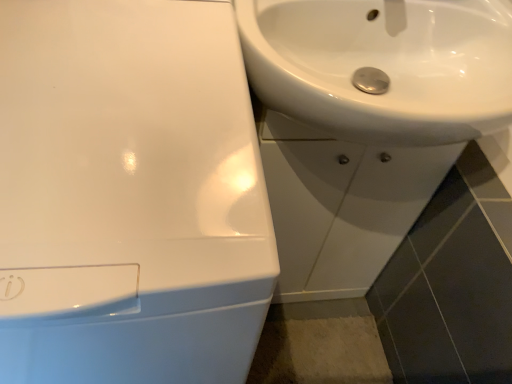
How much space does white glossy sink at center, which ranks as the second sink in left-to-right order, occupy horizontally?

The width of white glossy sink at center, which ranks as the second sink in left-to-right order, is 10.98 inches.

The width and height of the screenshot is (512, 384). What do you see at coordinates (383, 66) in the screenshot?
I see `white glossy sink at upper right, which appears as the third sink when viewed from the left` at bounding box center [383, 66].

Locate an element on the screen. The image size is (512, 384). white glossy sink at center, which ranks as the second sink in left-to-right order is located at coordinates (366, 122).

From the image's perspective, between white glossy sink at upper right, which appears as the third sink when viewed from the left, and white glossy sink at center, which appears as the 2th sink when viewed from the right, who is located below?

white glossy sink at center, which appears as the 2th sink when viewed from the right.

From a real-world perspective, is white glossy sink at upper right, which appears as the first sink when viewed from the right, positioned above or below white glossy sink at center, which appears as the 2th sink when viewed from the right?

white glossy sink at upper right, which appears as the first sink when viewed from the right, is situated higher than white glossy sink at center, which appears as the 2th sink when viewed from the right, in the real world.

How different are the orientations of white glossy sink at upper right, which appears as the first sink when viewed from the right, and white glossy sink at center, which appears as the 2th sink when viewed from the right, in degrees?

The angle between the facing direction of white glossy sink at upper right, which appears as the first sink when viewed from the right, and the facing direction of white glossy sink at center, which appears as the 2th sink when viewed from the right, is 0.000336 degrees.

From the picture: Is white glossy sink at upper right, which appears as the first sink when viewed from the right, positioned with its back to white glossy sink at upper right, marked as the 1th sink in a left-to-right arrangement?

No.

Is white glossy sink at upper right, which appears as the first sink when viewed from the right, at the right side of white glossy sink at upper right, marked as the 1th sink in a left-to-right arrangement?

Yes, white glossy sink at upper right, which appears as the first sink when viewed from the right, is to the right of white glossy sink at upper right, marked as the 1th sink in a left-to-right arrangement.

From a real-world perspective, is white glossy sink at upper right, which appears as the first sink when viewed from the right, positioned under white glossy sink at upper right, marked as the 1th sink in a left-to-right arrangement, based on gravity?

No, from a real-world perspective, white glossy sink at upper right, which appears as the first sink when viewed from the right, is not below white glossy sink at upper right, marked as the 1th sink in a left-to-right arrangement.

Is white glossy sink at upper right, which appears as the third sink when viewed from the left, further to the viewer compared to white glossy sink at upper right, acting as the third sink starting from the right?

Yes, white glossy sink at upper right, which appears as the third sink when viewed from the left, is further from the camera.

From a real-world perspective, is white glossy sink at center, which ranks as the second sink in left-to-right order, physically below white glossy sink at upper right, marked as the 1th sink in a left-to-right arrangement?

Yes, from a real-world perspective, white glossy sink at center, which ranks as the second sink in left-to-right order, is beneath white glossy sink at upper right, marked as the 1th sink in a left-to-right arrangement.

Can you tell me how much white glossy sink at center, which ranks as the second sink in left-to-right order, and white glossy sink at upper right, marked as the 1th sink in a left-to-right arrangement, differ in facing direction?

white glossy sink at center, which ranks as the second sink in left-to-right order, and white glossy sink at upper right, marked as the 1th sink in a left-to-right arrangement, are facing 1.32 degrees away from each other.

Considering their positions, is white glossy sink at center, which ranks as the second sink in left-to-right order, located in front of or behind white glossy sink at upper right, marked as the 1th sink in a left-to-right arrangement?

white glossy sink at center, which ranks as the second sink in left-to-right order, is behind white glossy sink at upper right, marked as the 1th sink in a left-to-right arrangement.

Considering the sizes of objects white glossy sink at center, which appears as the 2th sink when viewed from the right, and white glossy sink at upper right, marked as the 1th sink in a left-to-right arrangement, in the image provided, who is taller, white glossy sink at center, which appears as the 2th sink when viewed from the right, or white glossy sink at upper right, marked as the 1th sink in a left-to-right arrangement,?

Standing taller between the two is white glossy sink at upper right, marked as the 1th sink in a left-to-right arrangement.

From the image's perspective, which one is positioned lower, white glossy sink at upper right, acting as the third sink starting from the right, or white glossy sink at center, which appears as the 2th sink when viewed from the right?

white glossy sink at upper right, acting as the third sink starting from the right, from the image's perspective.

Can you tell me how much white glossy sink at upper right, marked as the 1th sink in a left-to-right arrangement, and white glossy sink at center, which ranks as the second sink in left-to-right order, differ in facing direction?

1.32 degrees.

From a real-world perspective, is white glossy sink at upper right, acting as the third sink starting from the right, positioned above or below white glossy sink at center, which ranks as the second sink in left-to-right order?

white glossy sink at upper right, acting as the third sink starting from the right, is situated higher than white glossy sink at center, which ranks as the second sink in left-to-right order, in the real world.

In terms of width, does white glossy sink at upper right, marked as the 1th sink in a left-to-right arrangement, look wider or thinner when compared to white glossy sink at center, which ranks as the second sink in left-to-right order?

Considering their sizes, white glossy sink at upper right, marked as the 1th sink in a left-to-right arrangement, looks broader than white glossy sink at center, which ranks as the second sink in left-to-right order.

From a real-world perspective, who is located lower, white glossy sink at upper right, acting as the third sink starting from the right, or white glossy sink at upper right, which appears as the third sink when viewed from the left?

white glossy sink at upper right, acting as the third sink starting from the right, is physically lower.

Considering the relative sizes of white glossy sink at upper right, acting as the third sink starting from the right, and white glossy sink at upper right, which appears as the first sink when viewed from the right, in the image provided, is white glossy sink at upper right, acting as the third sink starting from the right, wider than white glossy sink at upper right, which appears as the first sink when viewed from the right,?

Yes.

Does point (74, 261) come in front of point (275, 62)?

That is True.

Is white glossy sink at center, which ranks as the second sink in left-to-right order, taller or shorter than white glossy sink at upper right, which appears as the third sink when viewed from the left?

Considering their sizes, white glossy sink at center, which ranks as the second sink in left-to-right order, has more height than white glossy sink at upper right, which appears as the third sink when viewed from the left.

Is white glossy sink at center, which ranks as the second sink in left-to-right order, far from white glossy sink at upper right, which appears as the third sink when viewed from the left?

No, white glossy sink at center, which ranks as the second sink in left-to-right order, is not far from white glossy sink at upper right, which appears as the third sink when viewed from the left.

The image size is (512, 384). There is a white glossy sink at upper right, which appears as the first sink when viewed from the right. Identify the location of the 1st sink below it (from the image's perspective). (366, 122).

Locate an element on the screen. sink that is the 2nd object above the white glossy sink at center, which appears as the 2th sink when viewed from the right (from a real-world perspective) is located at coordinates (383, 66).

This screenshot has height=384, width=512. Find the location of `the 1st sink located beneath the white glossy sink at upper right, which appears as the third sink when viewed from the left (from a real-world perspective)`. the 1st sink located beneath the white glossy sink at upper right, which appears as the third sink when viewed from the left (from a real-world perspective) is located at coordinates (129, 195).

Consider the image. Looking at the image, which one is located further to white glossy sink at upper right, marked as the 1th sink in a left-to-right arrangement, white glossy sink at center, which ranks as the second sink in left-to-right order, or white glossy sink at upper right, which appears as the first sink when viewed from the right?

white glossy sink at center, which ranks as the second sink in left-to-right order, is positioned further to the anchor white glossy sink at upper right, marked as the 1th sink in a left-to-right arrangement.

Based on their spatial positions, is white glossy sink at upper right, acting as the third sink starting from the right, or white glossy sink at upper right, which appears as the third sink when viewed from the left, closer to white glossy sink at center, which ranks as the second sink in left-to-right order?

white glossy sink at upper right, which appears as the third sink when viewed from the left, lies closer to white glossy sink at center, which ranks as the second sink in left-to-right order, than the other object.

Estimate the real-world distances between objects in this image. Which object is further from white glossy sink at center, which appears as the 2th sink when viewed from the right, white glossy sink at upper right, which appears as the third sink when viewed from the left, or white glossy sink at upper right, acting as the third sink starting from the right?

white glossy sink at upper right, acting as the third sink starting from the right, is further to white glossy sink at center, which appears as the 2th sink when viewed from the right.

Consider the image. From the image, which object appears to be nearer to white glossy sink at upper right, marked as the 1th sink in a left-to-right arrangement, white glossy sink at upper right, which appears as the third sink when viewed from the left, or white glossy sink at center, which appears as the 2th sink when viewed from the right?

white glossy sink at upper right, which appears as the third sink when viewed from the left.

When comparing their distances from white glossy sink at upper right, which appears as the third sink when viewed from the left, does white glossy sink at upper right, acting as the third sink starting from the right, or white glossy sink at center, which ranks as the second sink in left-to-right order, seem closer?

white glossy sink at center, which ranks as the second sink in left-to-right order, is closer to white glossy sink at upper right, which appears as the third sink when viewed from the left.

In the scene shown: When comparing their distances from white glossy sink at upper right, which appears as the third sink when viewed from the left, does white glossy sink at center, which ranks as the second sink in left-to-right order, or white glossy sink at upper right, acting as the third sink starting from the right, seem closer?

The object closer to white glossy sink at upper right, which appears as the third sink when viewed from the left, is white glossy sink at center, which ranks as the second sink in left-to-right order.

Image resolution: width=512 pixels, height=384 pixels. I want to click on sink between white glossy sink at upper right, marked as the 1th sink in a left-to-right arrangement, and white glossy sink at upper right, which appears as the first sink when viewed from the right, so click(x=366, y=122).